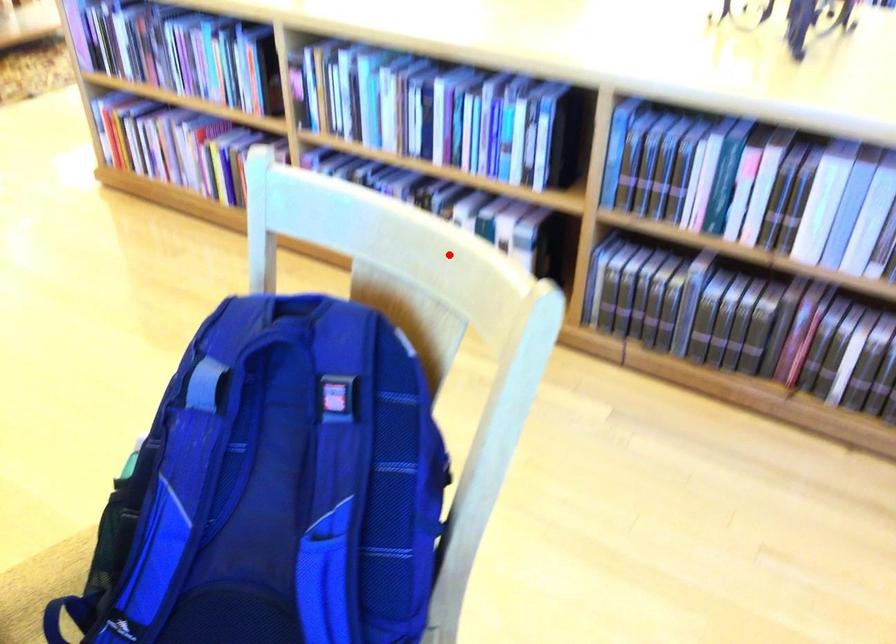
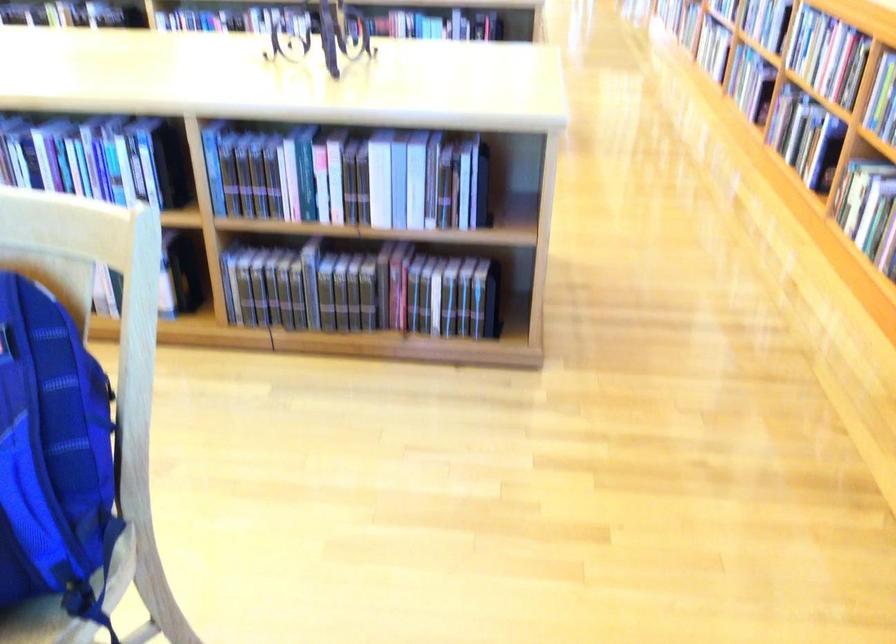
Question: I am providing you with two images of the same scene from different viewpoints. A red point is shown in image1. For the corresponding object point in image2, is it positioned nearer or farther from the camera?

Choices:
 (A) Nearer
 (B) Farther

Answer: (B)